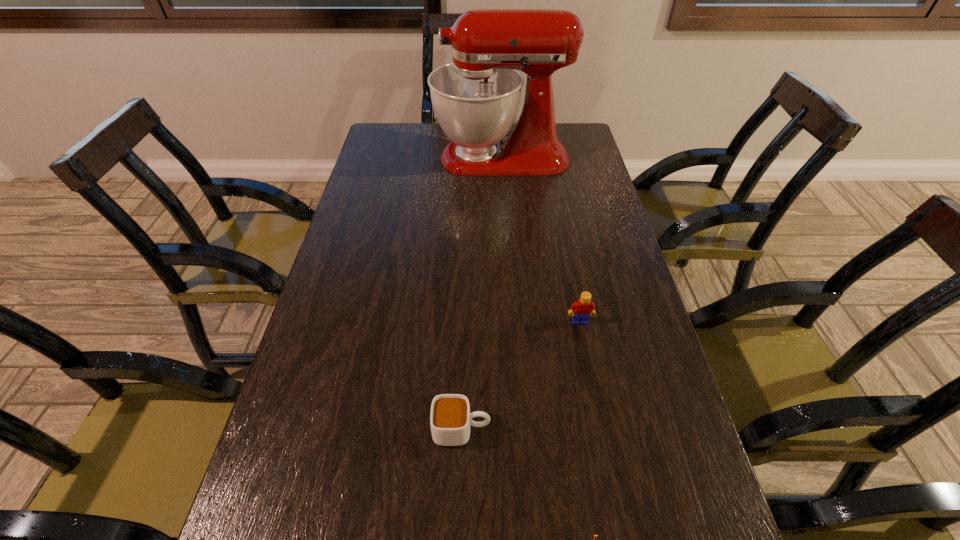
Identify the location of free location located 0.050m on the side with the handle of the third tallest object. (516, 429).

The width and height of the screenshot is (960, 540). Find the location of `object that is at the far edge`. object that is at the far edge is located at coordinates (476, 98).

Image resolution: width=960 pixels, height=540 pixels. Find the location of `mixer at the right edge`. mixer at the right edge is located at coordinates (476, 98).

The width and height of the screenshot is (960, 540). Find the location of `Lego that is at the right edge`. Lego that is at the right edge is located at coordinates (583, 308).

You are a GUI agent. You are given a task and a screenshot of the screen. Output one action in this format:
    pyautogui.click(x=<x>, y=<y>)
    Task: Click on the object located in the far right corner section of the desktop
    
    Given the screenshot: What is the action you would take?
    pyautogui.click(x=476, y=98)

Find the location of a particular element. Image resolution: width=960 pixels, height=540 pixels. free location at the left edge of the desktop is located at coordinates (359, 217).

I want to click on vacant space at the right edge, so click(569, 231).

Image resolution: width=960 pixels, height=540 pixels. I want to click on free region at the far right corner of the desktop, so click(x=579, y=139).

Identify the location of vacant area that lies between the second tallest object and the farthest object. click(x=540, y=240).

Where is `free space between the cup and the second farthest object`? This screenshot has width=960, height=540. free space between the cup and the second farthest object is located at coordinates (520, 376).